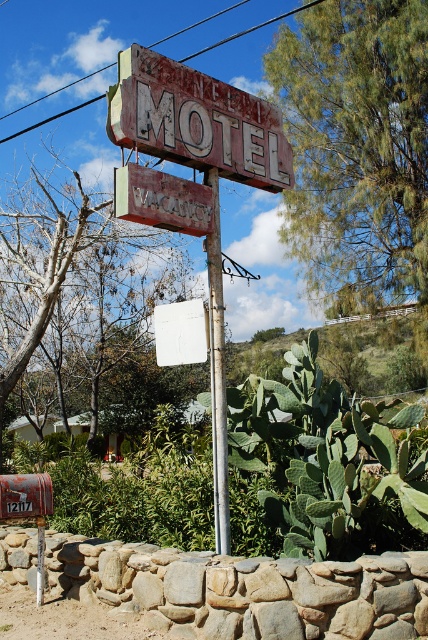
Question: Can you confirm if rusty metal motel sign at upper center is wider than metallic pole at center?

Choices:
 (A) no
 (B) yes

Answer: (B)

Question: Which of the following is the closest to the observer?

Choices:
 (A) metallic pole at center
 (B) rusty metal motel sign at upper center

Answer: (B)

Question: Which point is closer to the camera?

Choices:
 (A) metallic pole at center
 (B) rusty metal motel sign at upper center

Answer: (B)

Question: Which of the following is the closest to the observer?

Choices:
 (A) (149, 70)
 (B) (228, 547)
 (C) (171, 200)

Answer: (B)

Question: Is wooden signboard at center bigger than metallic pole at center?

Choices:
 (A) no
 (B) yes

Answer: (A)

Question: Is rusty metal motel sign at upper center closer to camera compared to metallic pole at center?

Choices:
 (A) yes
 (B) no

Answer: (A)